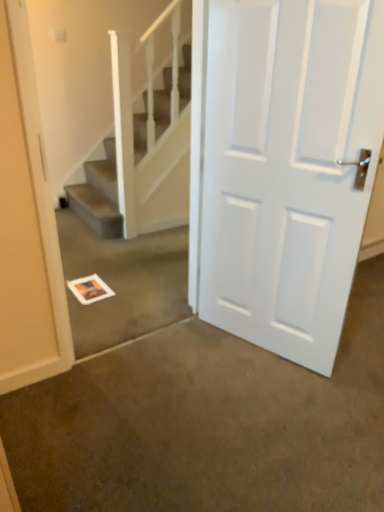
Question: In terms of height, does white textured stairs at upper center look taller or shorter compared to white matte door at center?

Choices:
 (A) short
 (B) tall

Answer: (A)

Question: Is point (102, 165) closer or farther from the camera than point (241, 268)?

Choices:
 (A) closer
 (B) farther

Answer: (B)

Question: Estimate the real-world distances between objects in this image. Which object is closer to the white paper at center?

Choices:
 (A) white matte door at center
 (B) white textured stairs at upper center

Answer: (B)

Question: Estimate the real-world distances between objects in this image. Which object is closer to the white paper at center?

Choices:
 (A) white textured stairs at upper center
 (B) white matte door at center

Answer: (A)